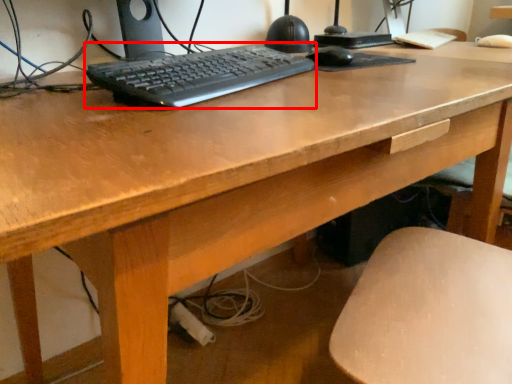
Question: Where is computer keyboard (annotated by the red box) located in relation to mouse in the image?

Choices:
 (A) right
 (B) left

Answer: (B)